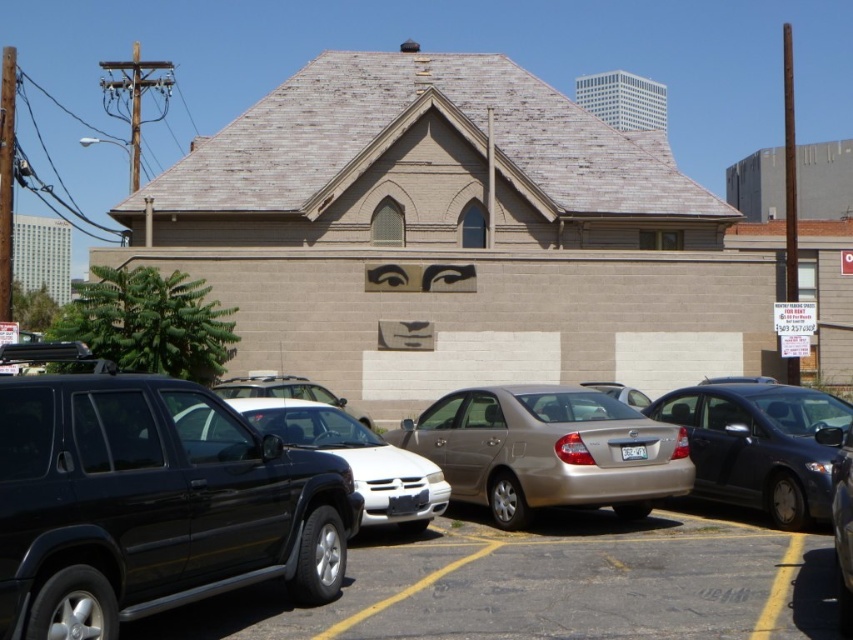
Question: Can you confirm if matte black suv at center is positioned above gold metallic sedan at center?

Choices:
 (A) yes
 (B) no

Answer: (B)

Question: Which object is the farthest from the shiny black suv at center?

Choices:
 (A) gold metallic sedan at center
 (B) satin black sedan at center
 (C) black rubber tire at lower left
 (D) black matte suv at left

Answer: (B)

Question: Which of these objects is positioned farthest from the black matte suv at left?

Choices:
 (A) satin black sedan at center
 (B) black rubber tire at lower left
 (C) matte black suv at center

Answer: (A)

Question: Can you confirm if black matte suv at left is positioned to the left of black rubber tire at lower left?

Choices:
 (A) no
 (B) yes

Answer: (B)

Question: Is black rubber tire at lower left closer to the viewer compared to shiny black suv at center?

Choices:
 (A) no
 (B) yes

Answer: (B)

Question: Which point is closer to the camera taking this photo?

Choices:
 (A) (675, 428)
 (B) (228, 497)
 (C) (238, 513)
 (D) (769, 529)

Answer: (B)